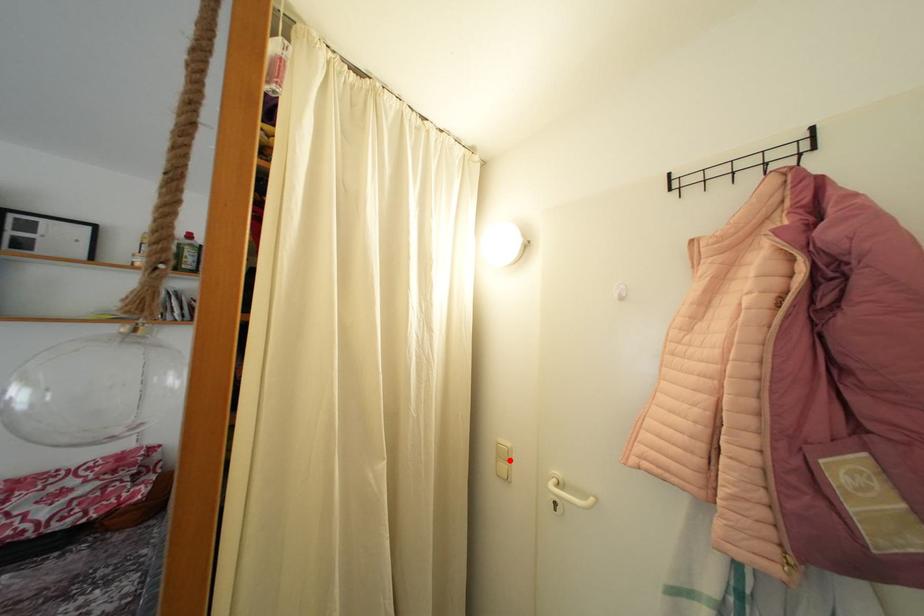
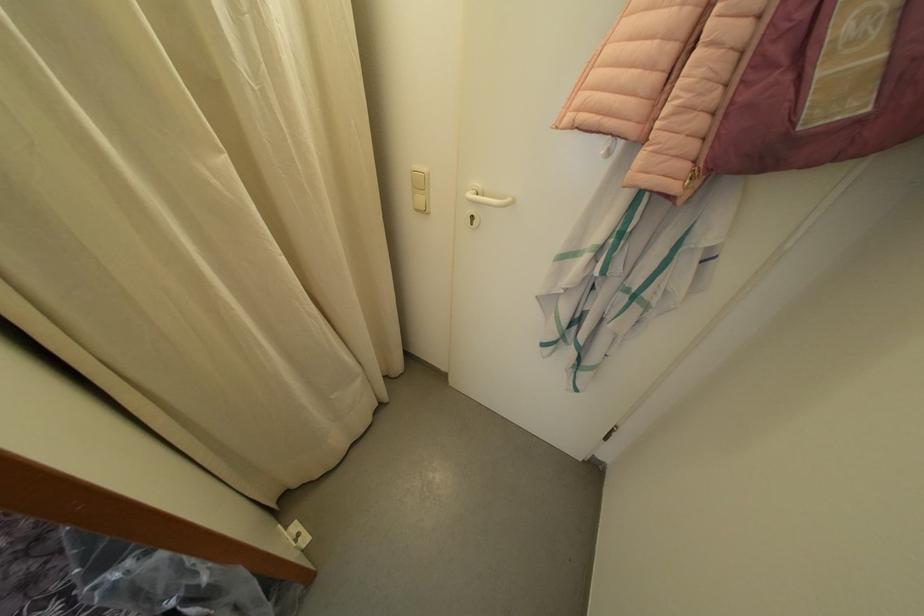
Question: I am providing you with two images of the same scene from different viewpoints. In image1, a red point is highlighted. Considering the same 3D point in image2, which of the following is correct?

Choices:
 (A) It is closer
 (B) It is farther

Answer: (A)